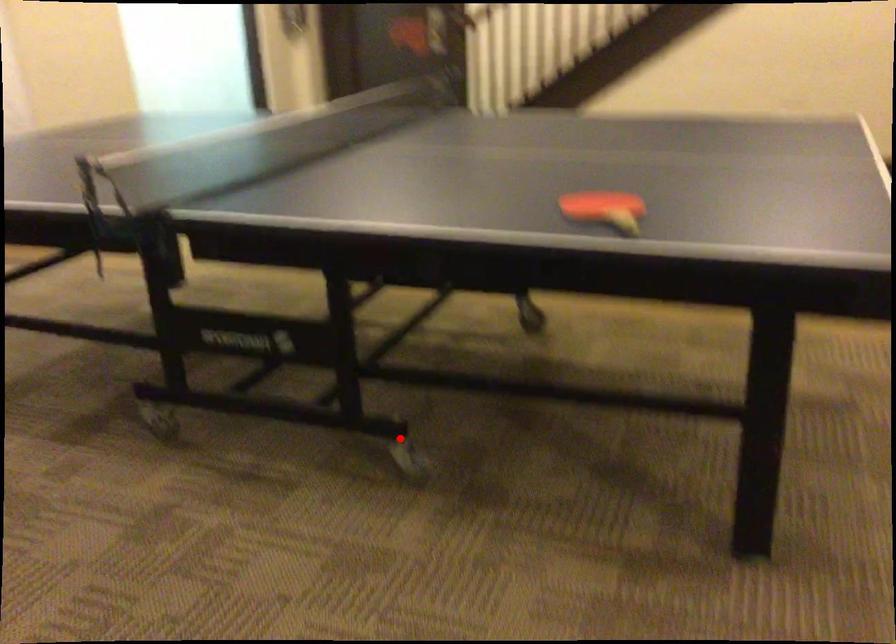
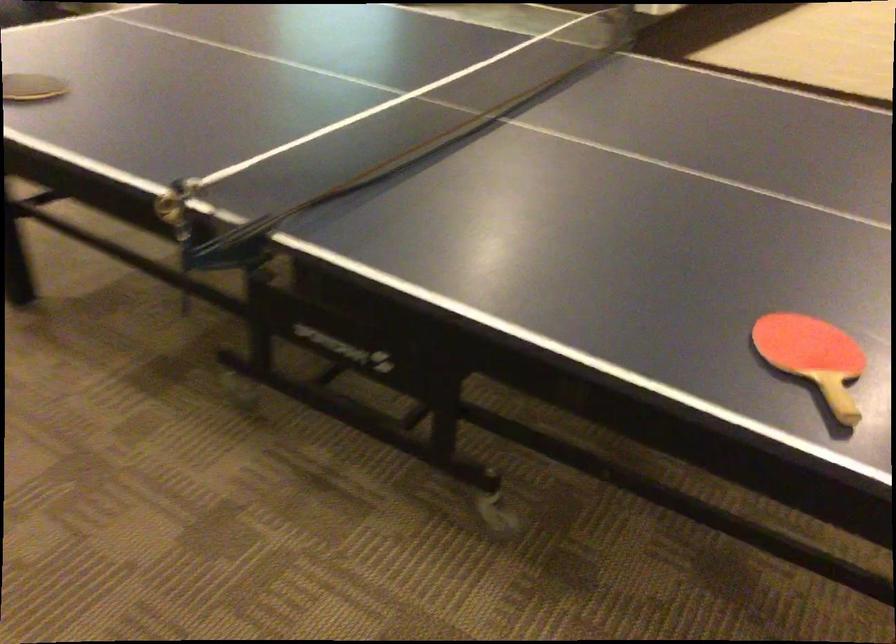
The point at the highlighted location is marked in the first image. Where is the corresponding point in the second image?

(488, 494)